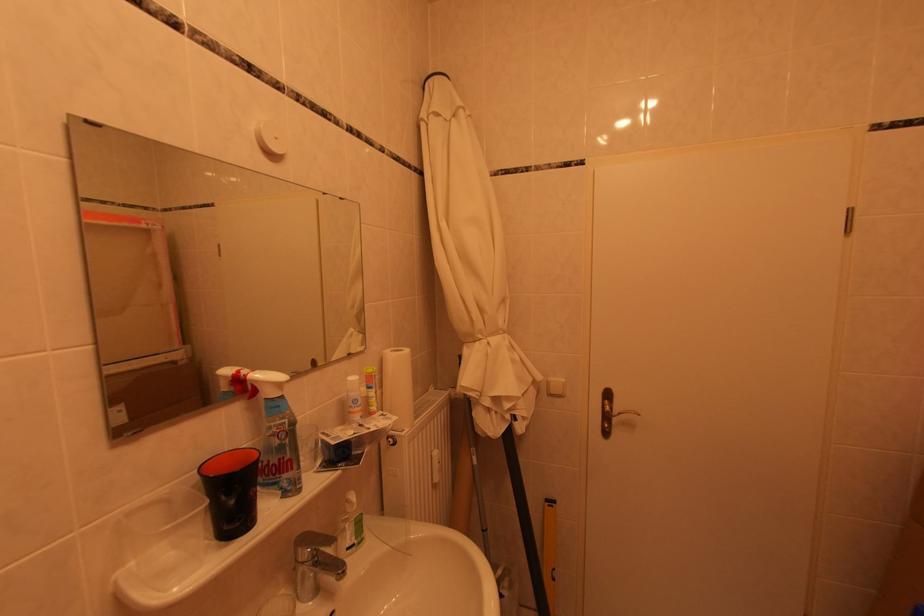
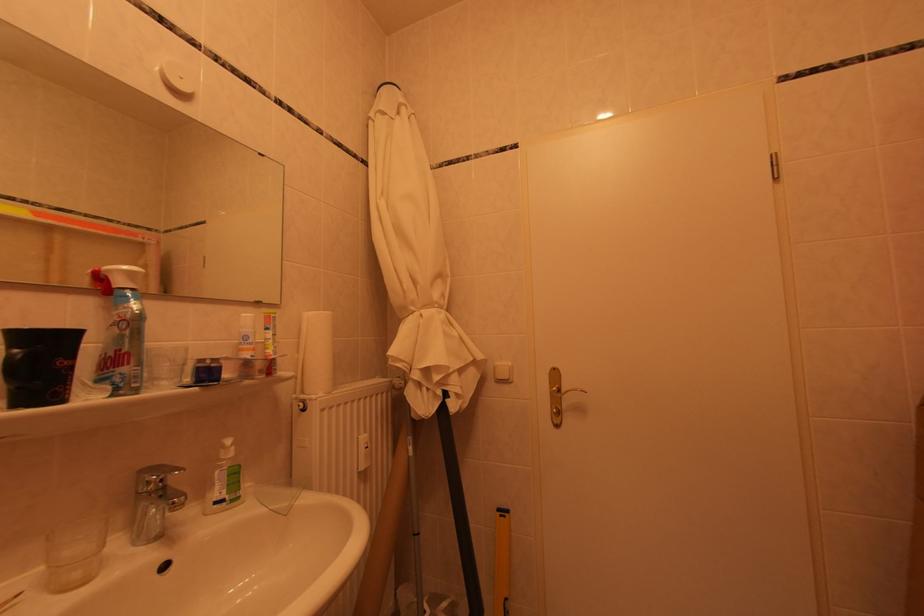
Locate, in the second image, the point that corresponds to [301,472] in the first image.

(138, 368)